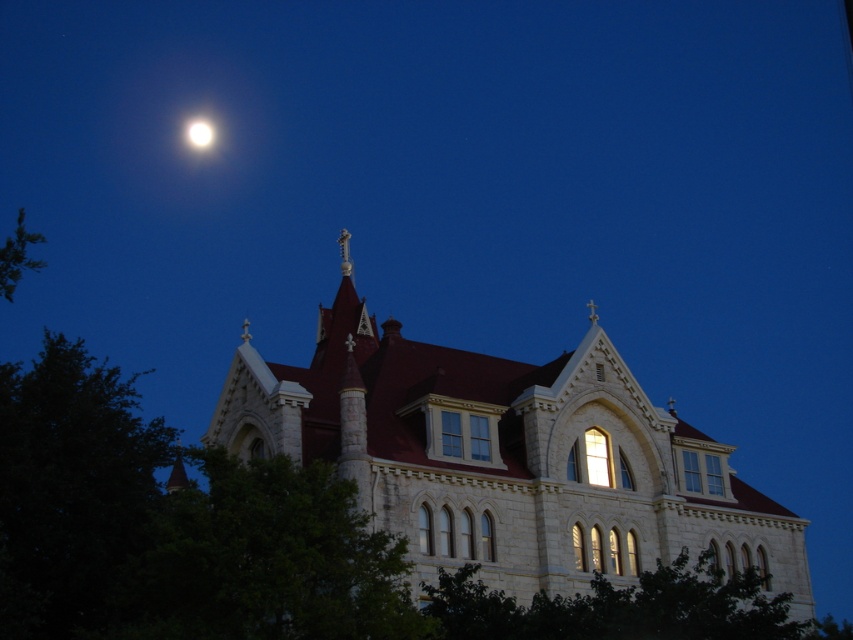
You are an astronomer observing the night sky and notice two bright white orbs in the upper part of the image. Given that the distance between them is crucial for identifying celestial objects, can you determine if the bright white orb at upper center is closer to the horizon than the bright white orb at upper left?

The bright white orb at upper center is 2.71 inches away from the bright white orb at upper left, but the description does not specify their positions relative to the horizon. Without additional information about their vertical alignment or elevation angles, it is impossible to determine which is closer to the horizon based solely on the provided distance.

You are an architect analyzing the proportions of the white stone church at center and the bright white orb at upper left in the image. Which object appears larger in the scene?

The white stone church at center appears larger than the bright white orb at upper left in the scene.